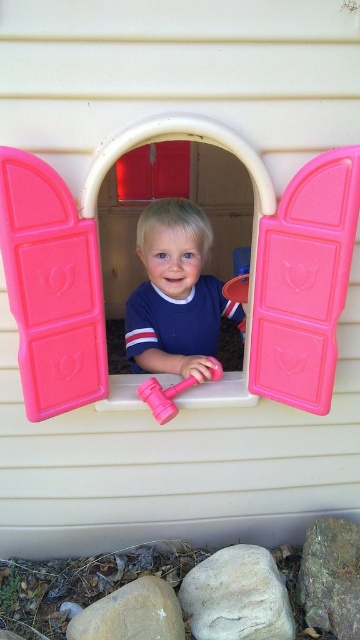
Question: Which object is the farthest from the pink rubber hammer at center?

Choices:
 (A) matte blue shirt at center
 (B) pink plastic hammer at center

Answer: (B)

Question: From the image, what is the correct spatial relationship of pink plastic hammer at center in relation to pink rubber hammer at center?

Choices:
 (A) right
 (B) left

Answer: (B)

Question: Estimate the real-world distances between objects in this image. Which object is farther from the pink plastic hammer at center?

Choices:
 (A) pink rubber hammer at center
 (B) matte blue shirt at center

Answer: (B)

Question: Can you confirm if matte blue shirt at center is positioned to the right of pink rubber hammer at center?

Choices:
 (A) yes
 (B) no

Answer: (A)

Question: Estimate the real-world distances between objects in this image. Which object is farther from the matte blue shirt at center?

Choices:
 (A) pink rubber hammer at center
 (B) pink plastic hammer at center

Answer: (B)

Question: Can you confirm if pink plastic hammer at center is positioned below matte blue shirt at center?

Choices:
 (A) no
 (B) yes

Answer: (A)